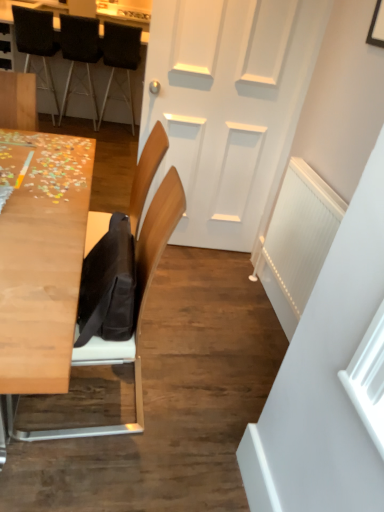
This screenshot has width=384, height=512. I want to click on free space between white plastic radiator at right and wooden chair at left, which is counted as the fourth chair, starting from the back, so click(x=215, y=337).